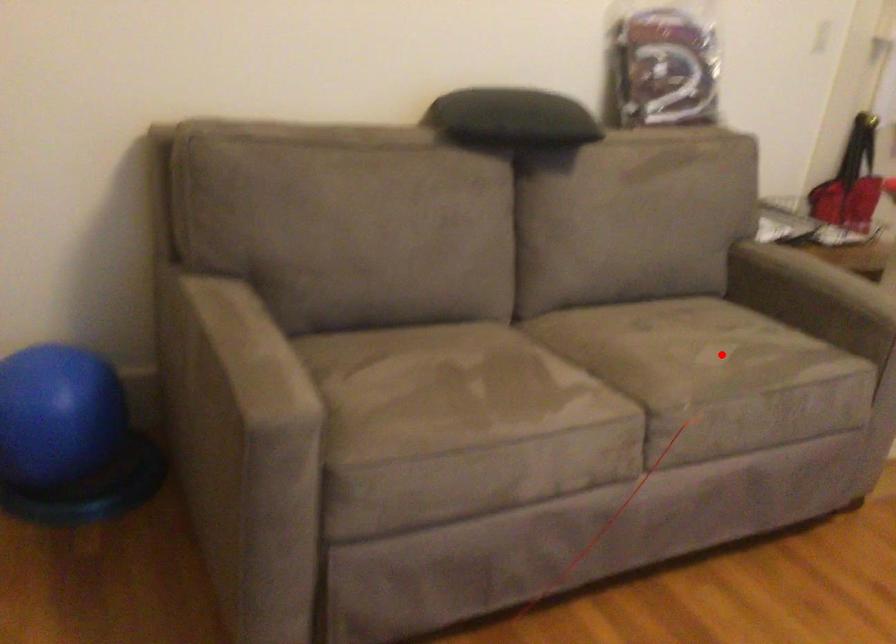
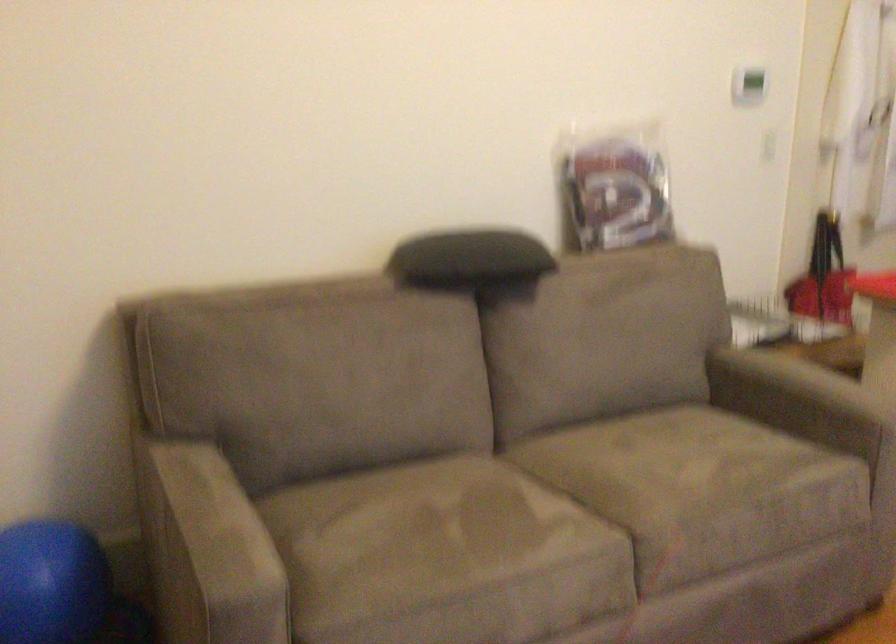
The point at the highlighted location is marked in the first image. Where is the corresponding point in the second image?

(702, 471)